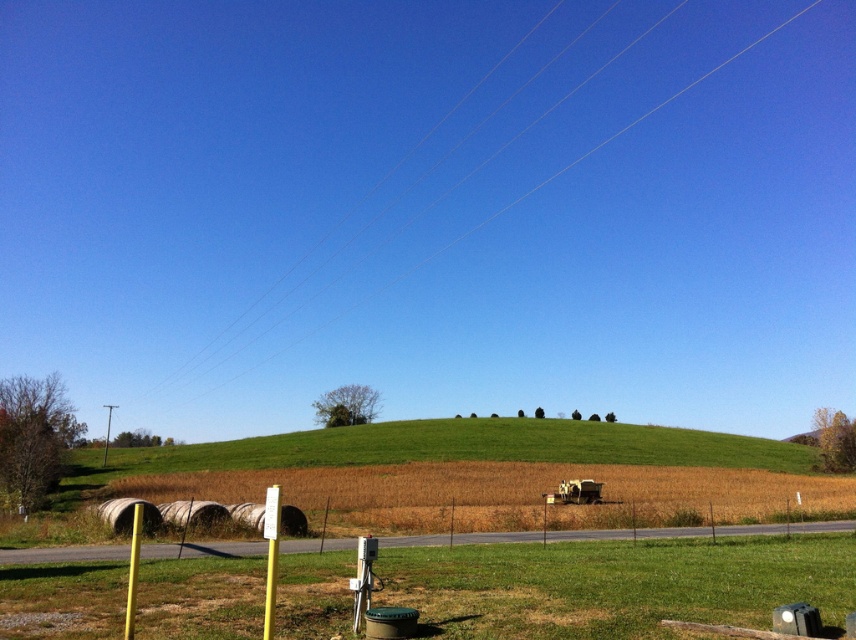
You are a drone operator planning to fly a drone from the green grassy hill at center to the clear blue sky at upper center. Considering the height difference between them, will the drone need to ascend or descend to reach its destination?

The green grassy hill at center has a lesser height compared to the clear blue sky at upper center, so the drone will need to ascend to reach the clear blue sky at upper center.

Consider the image. You are a drone operator planning to fly a drone from the green grassy hill at center to the clear blue sky at upper center. Based on the scene, will the drone have to ascend or descend to reach its destination?

The green grassy hill at center is in front of the clear blue sky at upper center, so the drone will have to ascend to reach the clear blue sky at upper center.